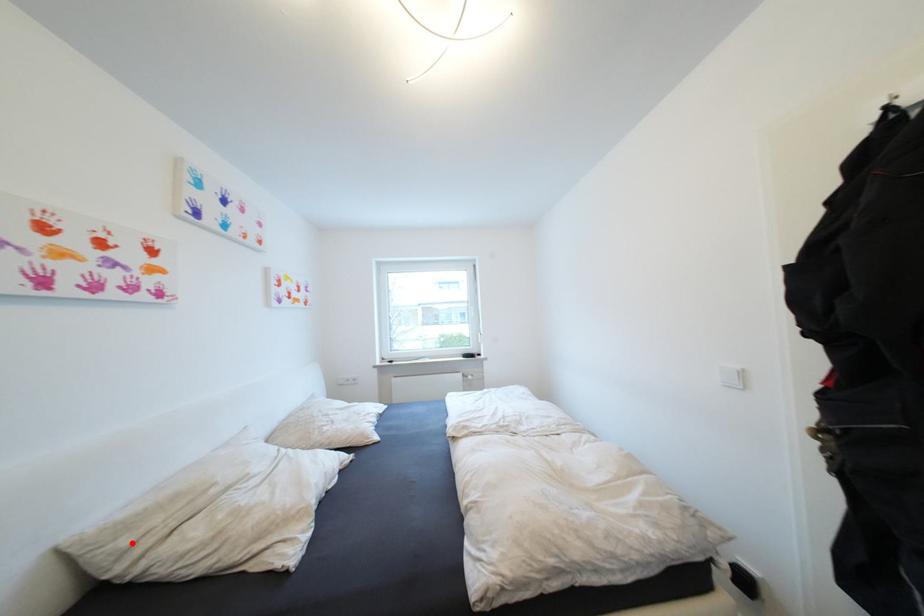
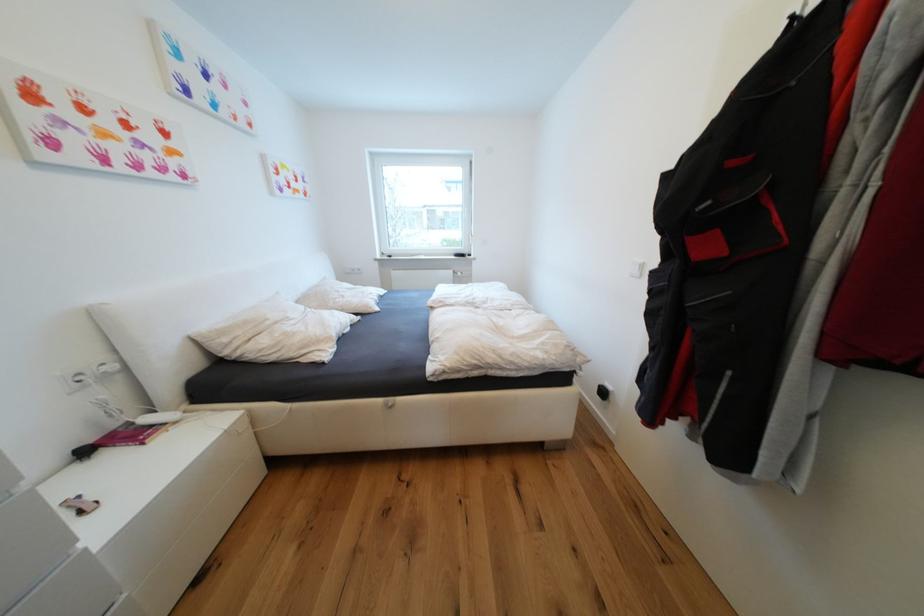
Question: I am providing you with two images of the same scene from different viewpoints. A red point is shown in image1. For the corresponding object point in image2, is it positioned nearer or farther from the camera?

Choices:
 (A) Nearer
 (B) Farther

Answer: (B)